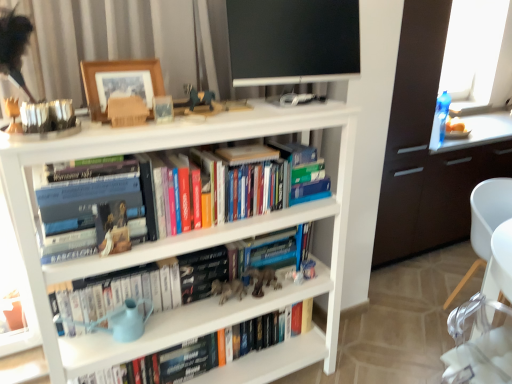
Question: From the image's perspective, is transparent glass window at upper right over black glossy flat-screen tv at upper center?

Choices:
 (A) no
 (B) yes

Answer: (B)

Question: Can you confirm if transparent glass window at upper right is wider than black glossy flat-screen tv at upper center?

Choices:
 (A) yes
 (B) no

Answer: (A)

Question: Is transparent glass window at upper right shorter than black glossy flat-screen tv at upper center?

Choices:
 (A) no
 (B) yes

Answer: (A)

Question: Is transparent glass window at upper right to the right of black glossy flat-screen tv at upper center from the viewer's perspective?

Choices:
 (A) no
 (B) yes

Answer: (B)

Question: Considering the relative positions of transparent glass window at upper right and black glossy flat-screen tv at upper center in the image provided, is transparent glass window at upper right behind black glossy flat-screen tv at upper center?

Choices:
 (A) no
 (B) yes

Answer: (B)

Question: Can you confirm if transparent glass window at upper right is taller than black glossy flat-screen tv at upper center?

Choices:
 (A) yes
 (B) no

Answer: (A)

Question: Considering the relative positions of metallic silver figurine at center and hardcover book at center in the image provided, is metallic silver figurine at center in front of hardcover book at center?

Choices:
 (A) yes
 (B) no

Answer: (B)

Question: From the image's perspective, is metallic silver figurine at center above hardcover book at center?

Choices:
 (A) no
 (B) yes

Answer: (A)

Question: Is metallic silver figurine at center positioned behind hardcover book at center?

Choices:
 (A) no
 (B) yes

Answer: (B)

Question: Does metallic silver figurine at center appear on the left side of hardcover book at center?

Choices:
 (A) yes
 (B) no

Answer: (B)

Question: Is metallic silver figurine at center facing towards hardcover book at center?

Choices:
 (A) no
 (B) yes

Answer: (A)

Question: Would you say metallic silver figurine at center is outside hardcover book at center?

Choices:
 (A) no
 (B) yes

Answer: (B)

Question: Is hardcover books at center surrounding black glossy flat-screen tv at upper center?

Choices:
 (A) no
 (B) yes

Answer: (A)